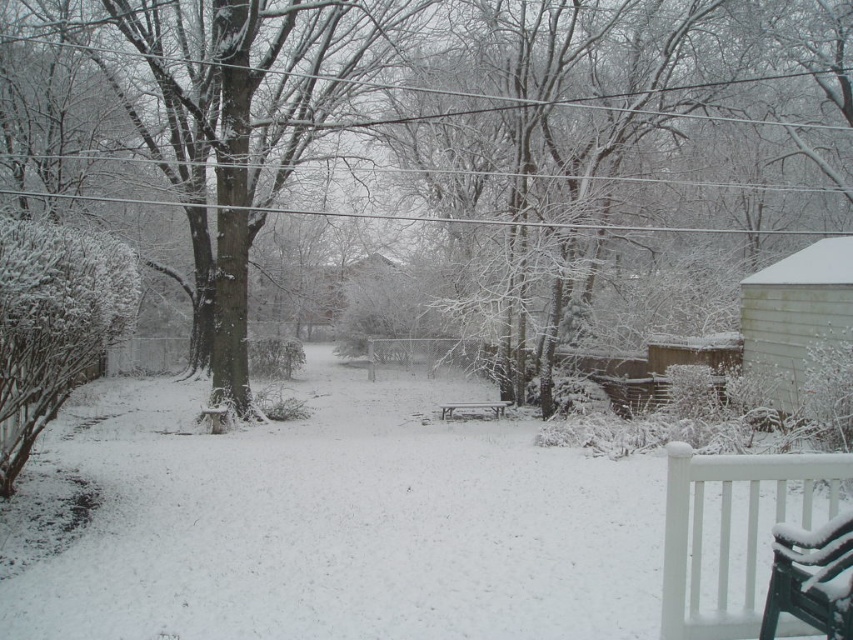
Does white fluffy snow at center appear on the left side of white wooden bench at lower right?

Yes, white fluffy snow at center is to the left of white wooden bench at lower right.

Can you confirm if white fluffy snow at center is smaller than white wooden bench at lower right?

No.

Where is `white fluffy snow at center`? The image size is (853, 640). white fluffy snow at center is located at coordinates (341, 524).

Where is `white fluffy snow at center`? white fluffy snow at center is located at coordinates (341, 524).

Is snow-covered wood bench at lower right wider than wooden park bench at center?

No, snow-covered wood bench at lower right is not wider than wooden park bench at center.

Is point (849, 556) positioned in front of point (445, 406)?

Yes, point (849, 556) is closer to viewer.

The height and width of the screenshot is (640, 853). Find the location of `snow-covered wood bench at lower right`. snow-covered wood bench at lower right is located at coordinates (811, 577).

Between white fluffy snow at center and wooden park bench at center, which one is positioned higher?

white fluffy snow at center is above.

Does white fluffy snow at center have a lesser width compared to wooden park bench at center?

No.

Is point (436, 637) more distant than point (457, 406)?

No, it is not.

Identify the location of white fluffy snow at center. (341, 524).